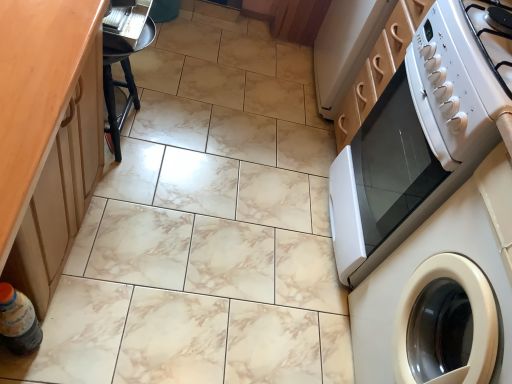
Question: Considering the positions of white glossy microwave at right and white glossy electric stove at upper right in the image, is white glossy microwave at right taller or shorter than white glossy electric stove at upper right?

Choices:
 (A) tall
 (B) short

Answer: (A)

Question: Is point (440, 100) closer or farther from the camera than point (429, 24)?

Choices:
 (A) farther
 (B) closer

Answer: (B)

Question: Based on their relative distances, which object is farther from the white glossy microwave at right?

Choices:
 (A) white glossy washing machine at right
 (B) dark brown plastic bottle at lower left
 (C) black wood bar stool at left
 (D) white glossy electric stove at upper right

Answer: (B)

Question: Considering the real-world distances, which object is farthest from the white glossy washing machine at right?

Choices:
 (A) white glossy electric stove at upper right
 (B) black wood bar stool at left
 (C) dark brown plastic bottle at lower left
 (D) white glossy microwave at right

Answer: (B)